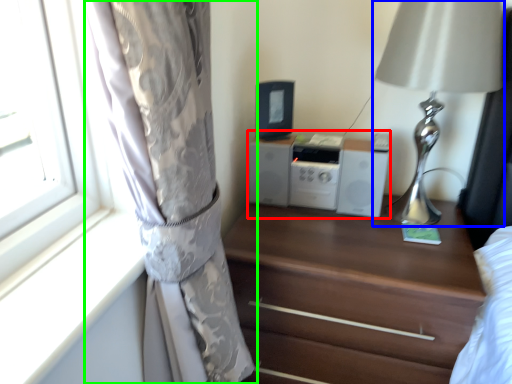
Question: Which object is positioned closest to stereo (highlighted by a red box)? Select from table lamp (highlighted by a blue box) and curtain (highlighted by a green box).

Choices:
 (A) table lamp
 (B) curtain

Answer: (A)